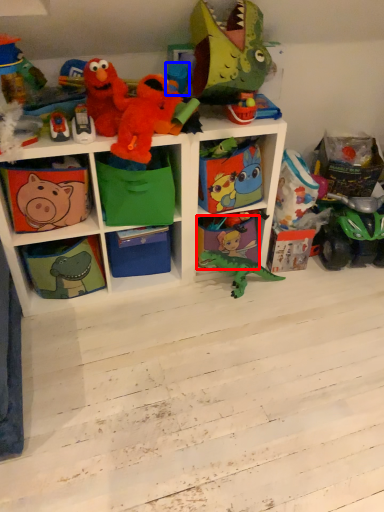
Question: Which of the following is the closest to the observer, shelf (highlighted by a red box) or toy (highlighted by a blue box)?

Choices:
 (A) shelf
 (B) toy

Answer: (B)